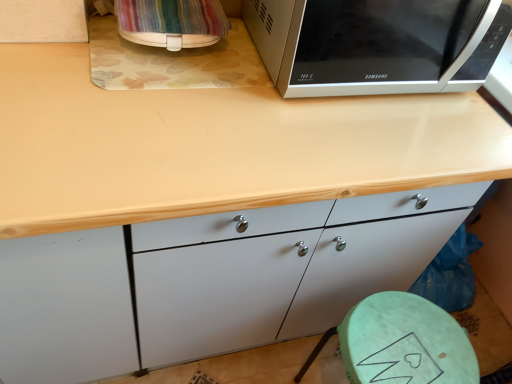
You are a GUI agent. You are given a task and a screenshot of the screen. Output one action in this format:
    pyautogui.click(x=<x>, y=<y>)
    Task: Click on the vacant area that is situated to the right of striped fabric bag at upper left
    The width and height of the screenshot is (512, 384).
    Given the screenshot: What is the action you would take?
    pyautogui.click(x=242, y=71)